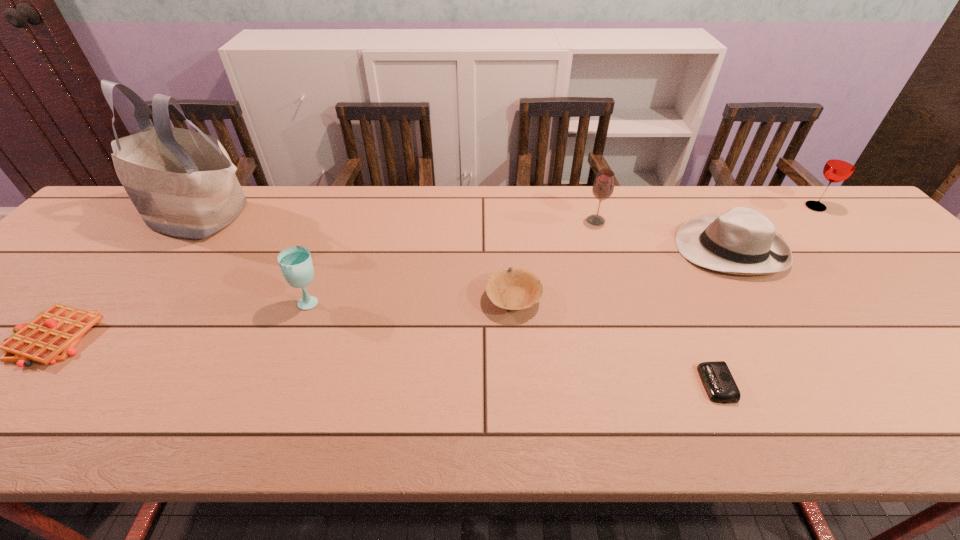
Find the location of a particular element. vacant area at the far edge of the desktop is located at coordinates (297, 219).

I want to click on vacant position at the near edge of the desktop, so click(x=87, y=397).

Locate an element on the screen. vacant area at the left edge is located at coordinates (60, 285).

In order to click on vacant position at the far right corner of the desktop in this screenshot , I will do `click(845, 221)`.

Find the location of a particular element. The height and width of the screenshot is (540, 960). empty space that is in between the fourth object from left to right and the rightmost glass is located at coordinates (664, 253).

Where is `vacant space that is in between the fedora and the fourth object from left to right`? This screenshot has width=960, height=540. vacant space that is in between the fedora and the fourth object from left to right is located at coordinates (622, 274).

At what (x,y) coordinates should I click in order to perform the action: click on free spot between the fifth object from left to right and the leftmost glass. Please return your answer as a coordinate pair (x, y). This screenshot has height=540, width=960. Looking at the image, I should click on (453, 261).

Locate an element on the screen. The image size is (960, 540). unoccupied position between the shopping bag and the fourth shortest object is located at coordinates (466, 232).

Find the location of a particular element. The width and height of the screenshot is (960, 540). object that is the sixth nearest to the second farthest glass is located at coordinates (182, 182).

Identify the location of object that is the sixth closest one to the fifth tallest object. (x=182, y=182).